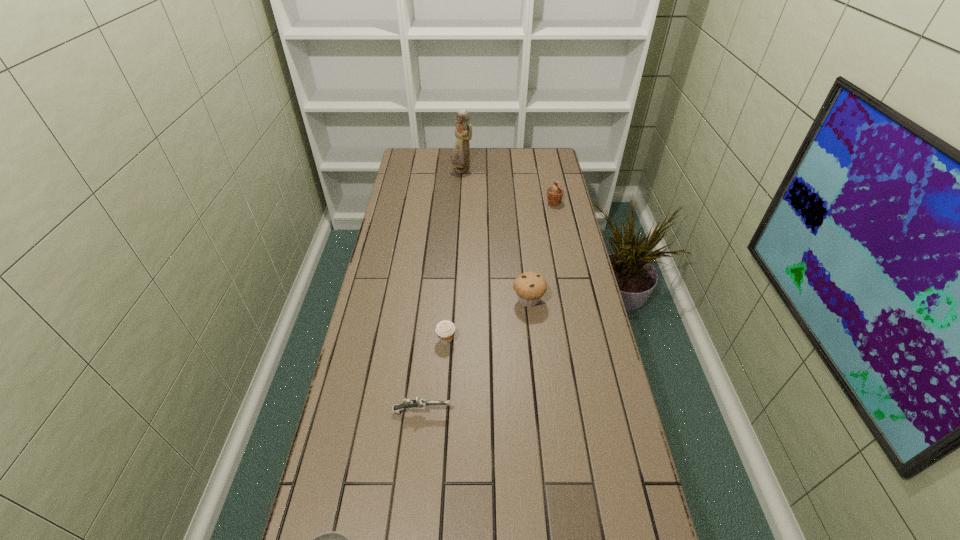
Image resolution: width=960 pixels, height=540 pixels. In order to click on free space between the rightmost muffin and the fifth tallest object in this screenshot , I will do `click(488, 307)`.

What are the coordinates of `free space between the nearest muffin and the rightmost object` in the screenshot? It's located at (500, 271).

Where is `vacant area between the farthest object and the gun`? vacant area between the farthest object and the gun is located at coordinates (442, 291).

I want to click on vacant area between the third farthest object and the rightmost muffin, so click(541, 251).

The height and width of the screenshot is (540, 960). What are the coordinates of `free point between the fifth farthest object and the rightmost object` in the screenshot? It's located at (488, 307).

Where is `free spot between the gun and the leftmost muffin`? free spot between the gun and the leftmost muffin is located at coordinates (x=434, y=375).

Identify the location of vacant space in between the fifth tallest object and the second farthest muffin. (475, 356).

Find the location of a particular element. This screenshot has height=540, width=960. the second closest object to the third nearest object is located at coordinates (419, 403).

Find the location of a particular element. The image size is (960, 540). the fourth closest object to the figurine is located at coordinates (419, 403).

Find the location of a particular element. The image size is (960, 540). muffin that can be found as the second closest to the nearest muffin is located at coordinates (554, 194).